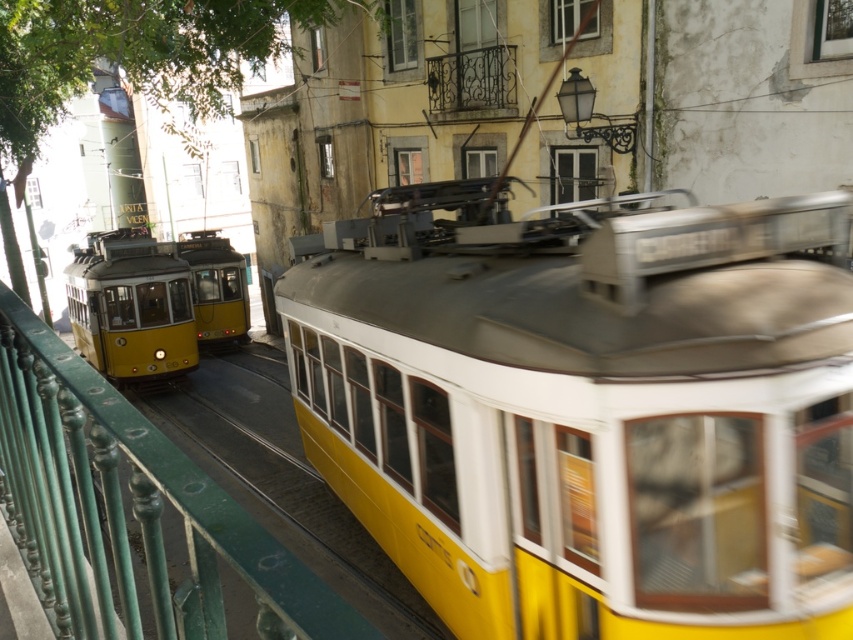
Question: Which of the following is the closest to the observer?

Choices:
 (A) (140, 282)
 (B) (187, 252)

Answer: (A)

Question: Can you confirm if green polished metal rail at center is smaller than yellow polished metal tram at left?

Choices:
 (A) no
 (B) yes

Answer: (B)

Question: Estimate the real-world distances between objects in this image. Which object is closer to the yellow polished metal tram at left?

Choices:
 (A) green polished metal rail at center
 (B) yellow matte train at center
 (C) yellow matte tram at left

Answer: (C)

Question: Is green polished metal rail at center bigger than yellow matte tram at left?

Choices:
 (A) yes
 (B) no

Answer: (A)

Question: Does green polished metal rail at center appear under yellow polished metal tram at left?

Choices:
 (A) no
 (B) yes

Answer: (B)

Question: Which of these objects is positioned closest to the yellow matte tram at left?

Choices:
 (A) yellow polished metal tram at left
 (B) green polished metal rail at center

Answer: (A)